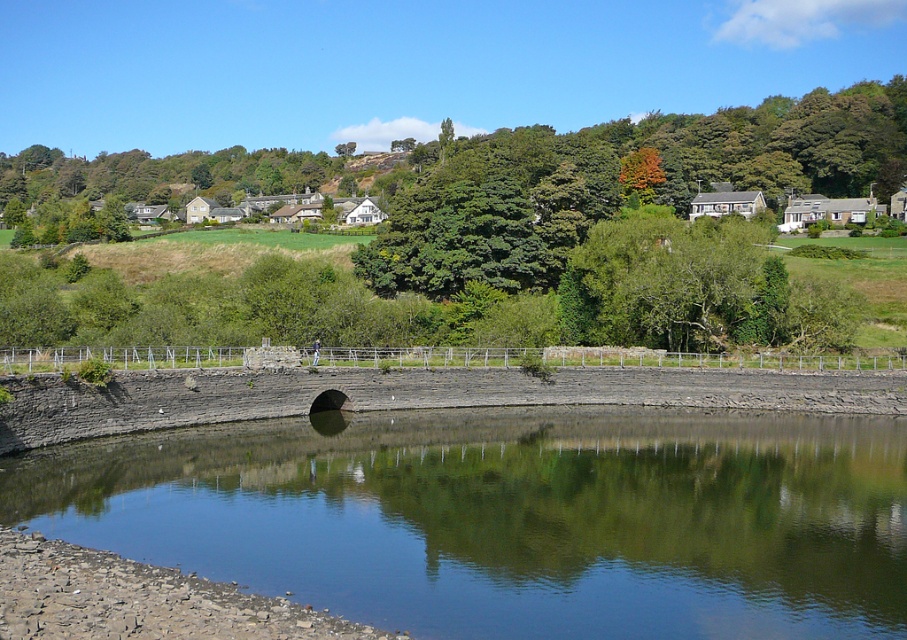
Is green leafy tree at upper center shorter than green leafy tree at center?

No.

Can you confirm if green leafy tree at upper center is wider than green leafy tree at center?

Indeed, green leafy tree at upper center has a greater width compared to green leafy tree at center.

Identify the location of green leafy tree at upper center. Image resolution: width=907 pixels, height=640 pixels. (618, 180).

Which is more to the right, clear water at center or green leafy tree at upper center?

green leafy tree at upper center is more to the right.

Locate an element on the screen. Image resolution: width=907 pixels, height=640 pixels. clear water at center is located at coordinates (511, 518).

Where is `clear water at center`? The image size is (907, 640). clear water at center is located at coordinates (511, 518).

Can you confirm if clear water at center is wider than green leafy tree at center?

Yes, clear water at center is wider than green leafy tree at center.

Which is above, clear water at center or green leafy tree at center?

green leafy tree at center

Identify the location of clear water at center. The width and height of the screenshot is (907, 640). (511, 518).

What are the coordinates of `clear water at center` in the screenshot? It's located at (511, 518).